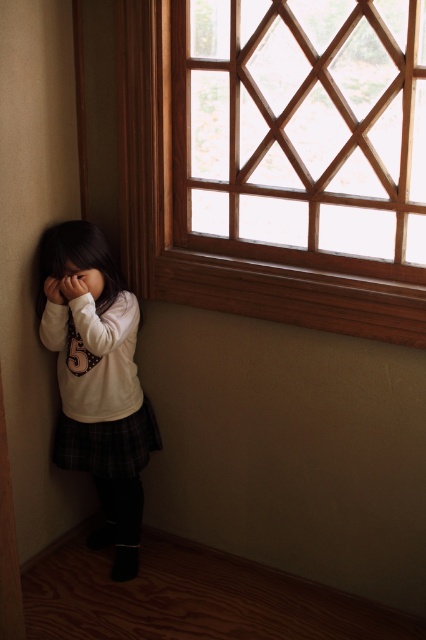
Locate an element on the screen. wooden lattice at upper right is located at coordinates (301, 131).

Is point (377, 58) closer to camera compared to point (101, 278)?

No.

Who is more distant from viewer, (307, 58) or (71, 275)?

Positioned behind is point (71, 275).

At what (x,y) coordinates should I click in order to perform the action: click on wooden lattice at upper right. Please return your answer as a coordinate pair (x, y). The height and width of the screenshot is (640, 426). Looking at the image, I should click on (301, 131).

Measure the distance between wooden lattice at upper right and white matte shirt at lower left.

wooden lattice at upper right is 3.16 meters away from white matte shirt at lower left.

Does wooden lattice at upper right have a greater width compared to white matte shirt at lower left?

Yes.

Does point (250, 198) lie in front of point (112, 461)?

No, it is not.

Locate an element on the screen. Image resolution: width=426 pixels, height=640 pixels. wooden lattice at upper right is located at coordinates (301, 131).

Is white matte shirt at lower left behind matte white face at lower left?

Yes, white matte shirt at lower left is further from the viewer.

Which is more to the left, white matte shirt at lower left or matte white face at lower left?

matte white face at lower left

Between point (92, 332) and point (80, 292), which one is positioned behind?

The point (80, 292) is behind.

I want to click on white matte shirt at lower left, so click(x=97, y=385).